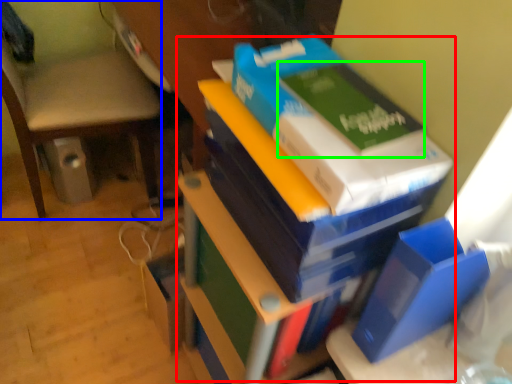
Question: Which object is positioned closest to bookcase (highlighted by a red box)? Select from chair (highlighted by a blue box) and paperback book (highlighted by a green box).

Choices:
 (A) chair
 (B) paperback book

Answer: (B)